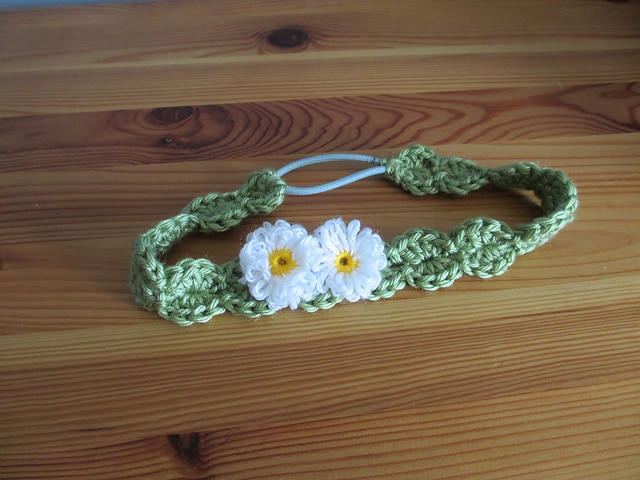
At what (x,y) coordinates should I click in order to perform the action: click on table. Please return your answer as a coordinate pair (x, y). This screenshot has width=640, height=480. Looking at the image, I should click on (507, 390), (134, 172).